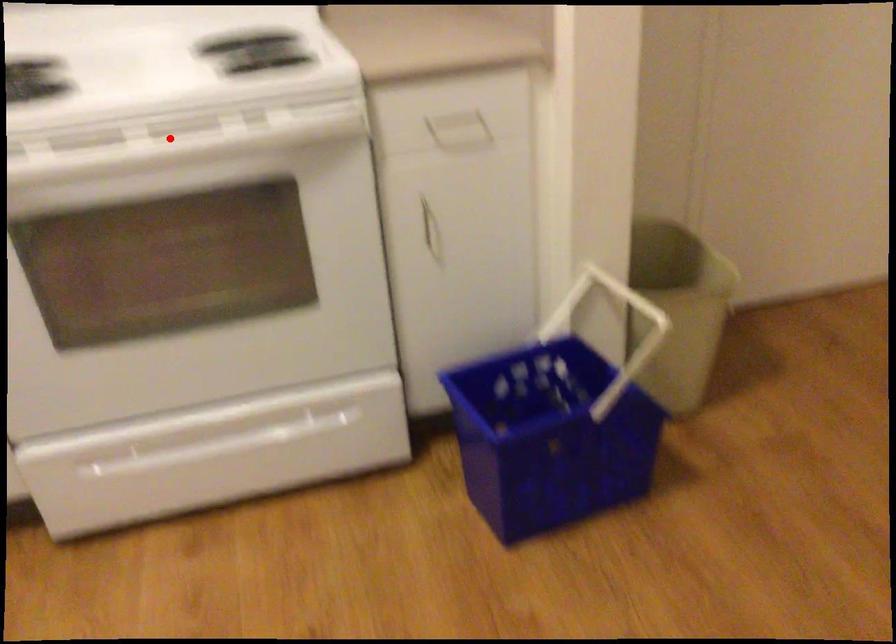
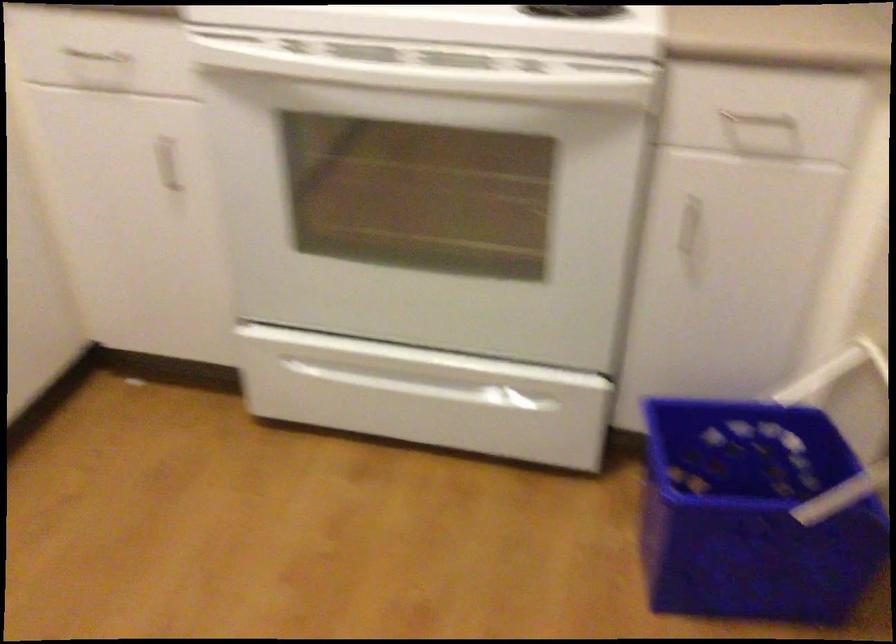
Locate, in the second image, the point that corresponds to the highlighted location in the first image.

(437, 77)